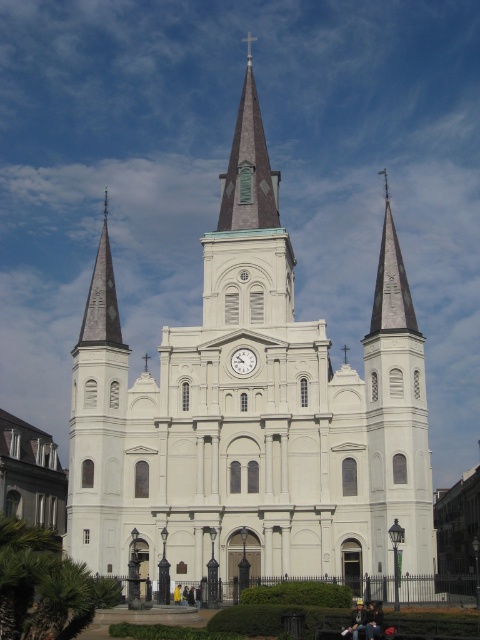
You are standing in front of the church and want to place a small statue between the two points, point (x=414, y=490) and point (x=235, y=140). Based on their positions, which point should the statue be closer to in order to be between them?

The statue should be closer to point (x=235, y=140) because point (x=414, y=490) is in front of point (x=235, y=140), meaning it is closer to the viewer. To be between them, the statue needs to be placed closer to the farther point.

You are a photographer planning to take a picture of the white smooth church at center and the green copper spire at upper center. Based on their sizes, which object should you focus on to ensure both are clearly visible in the frame?

The white smooth church at center is larger than the green copper spire at upper center, so focusing on the white smooth church at center will ensure both are clearly visible in the frame.